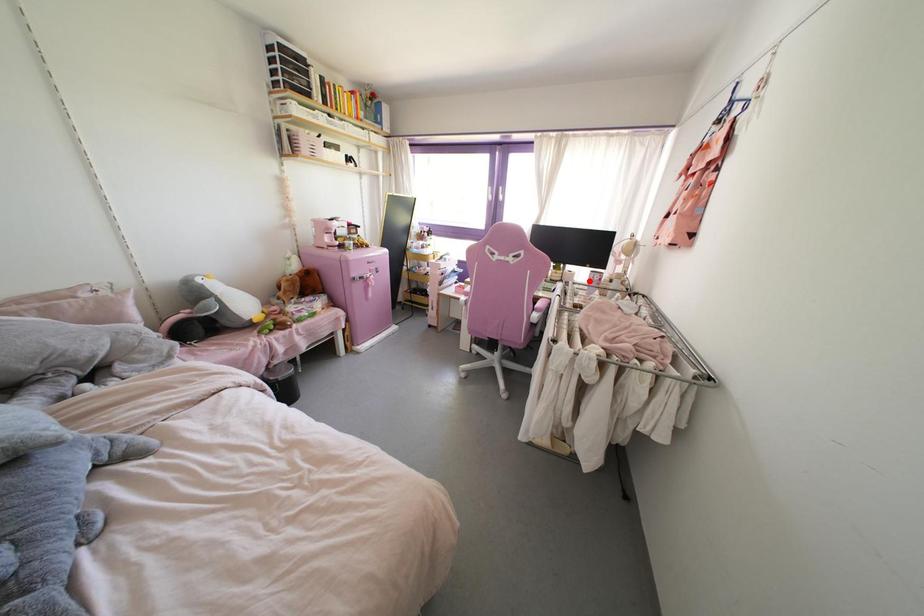
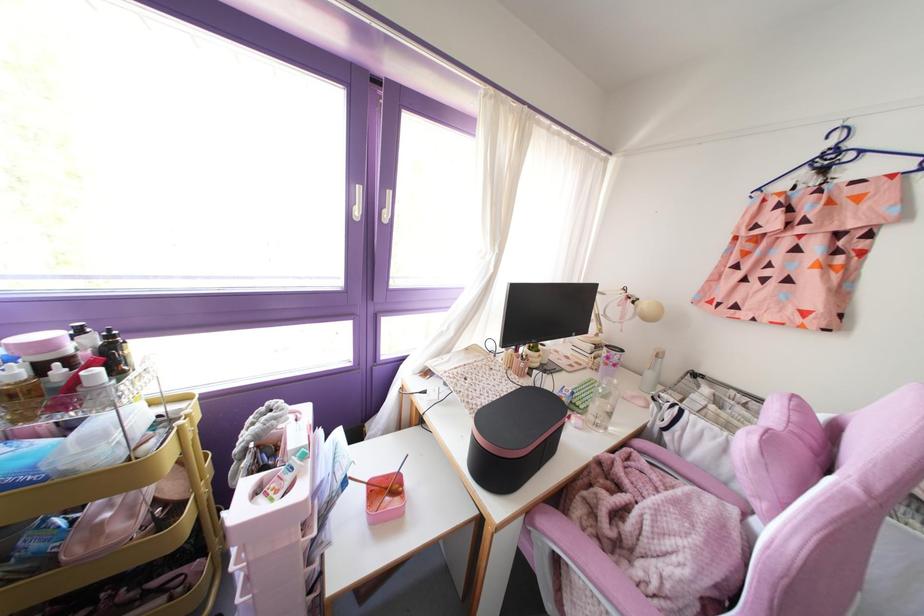
In the second image, find the point that corresponds to the highlighted location in the first image.

(614, 365)